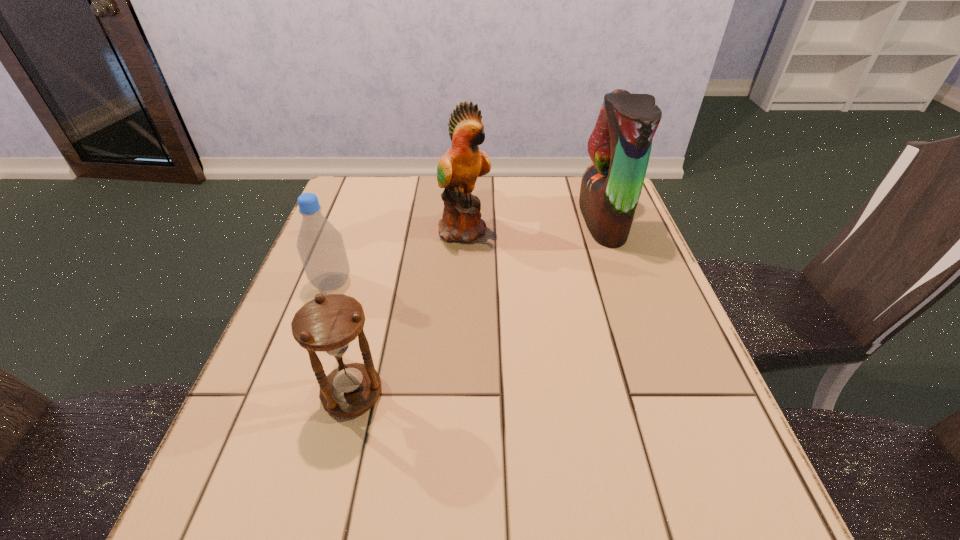
Find the location of a particular element. free space at the near left corner of the desktop is located at coordinates (307, 491).

This screenshot has height=540, width=960. In order to click on empty location between the right parrot and the nearest object in this screenshot , I will do `click(477, 308)`.

Locate an element on the screen. This screenshot has width=960, height=540. free point between the right parrot and the bottle is located at coordinates (468, 252).

At what (x,y) coordinates should I click in order to perform the action: click on empty space that is in between the rightmost object and the third object from left to right. Please return your answer as a coordinate pair (x, y). This screenshot has width=960, height=540. Looking at the image, I should click on (534, 225).

Locate an element on the screen. This screenshot has width=960, height=540. blank region between the leftmost object and the left parrot is located at coordinates (398, 256).

At what (x,y) coordinates should I click in order to perform the action: click on vacant region between the right parrot and the left parrot. Please return your answer as a coordinate pair (x, y). Image resolution: width=960 pixels, height=540 pixels. Looking at the image, I should click on (534, 225).

Identify the location of free space between the right parrot and the left parrot. The image size is (960, 540). (534, 225).

At what (x,y) coordinates should I click in order to perform the action: click on free spot between the rightmost object and the second nearest object. Please return your answer as a coordinate pair (x, y). This screenshot has height=540, width=960. Looking at the image, I should click on (468, 252).

Find the location of a particular element. Image resolution: width=960 pixels, height=540 pixels. blank region between the left parrot and the bottle is located at coordinates (398, 256).

Select which object is the closest to the left parrot. Please provide its 2D coordinates. Your answer should be formatted as a tuple, i.e. [(x, y)], where the tuple contains the x and y coordinates of a point satisfying the conditions above.

[(320, 245)]